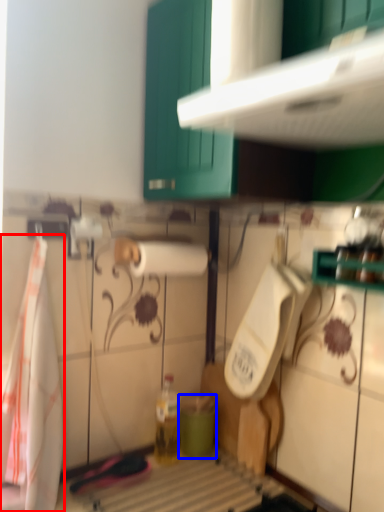
Question: Which object appears closest to the camera in this image, beach towel (highlighted by a red box) or teal (highlighted by a blue box)?

Choices:
 (A) beach towel
 (B) teal

Answer: (A)